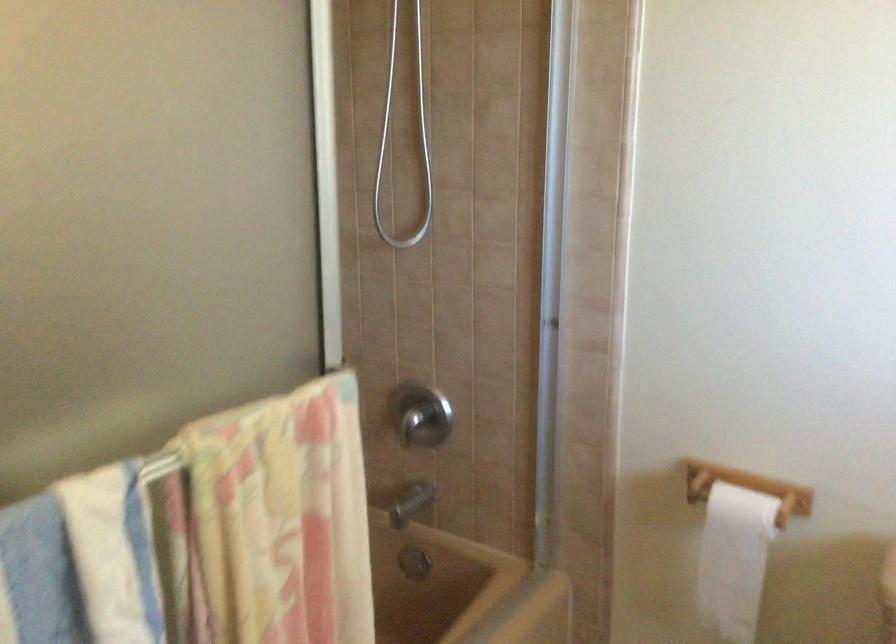
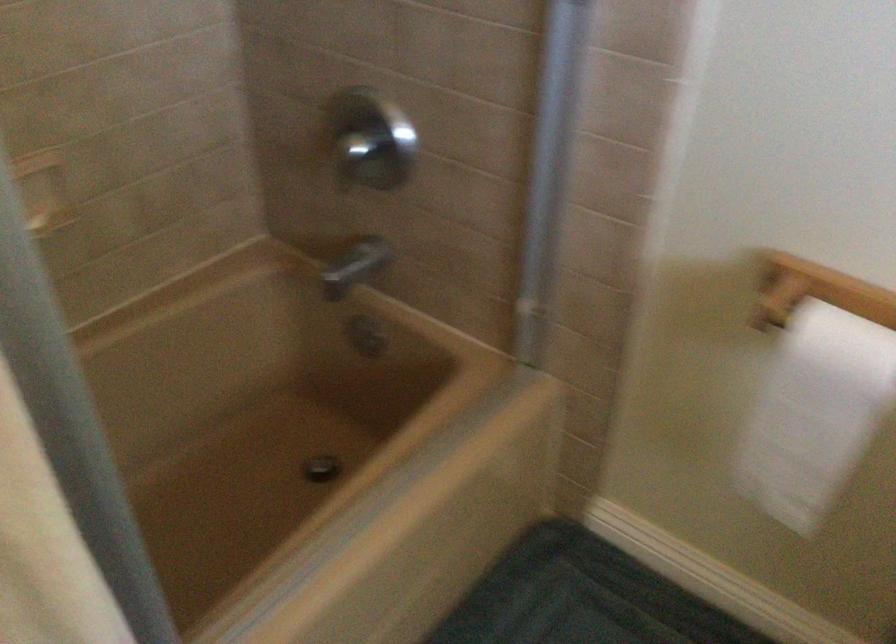
Question: The first image is from the beginning of the video and the second image is from the end. How did the camera likely rotate when shooting the video?

Choices:
 (A) Left
 (B) Right
 (C) Up
 (D) Down

Answer: (D)